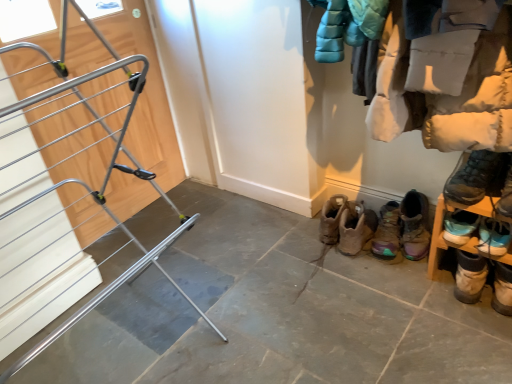
This screenshot has height=384, width=512. Find the location of `vacant space to the right of silver metallic drying rack at left`. vacant space to the right of silver metallic drying rack at left is located at coordinates (270, 316).